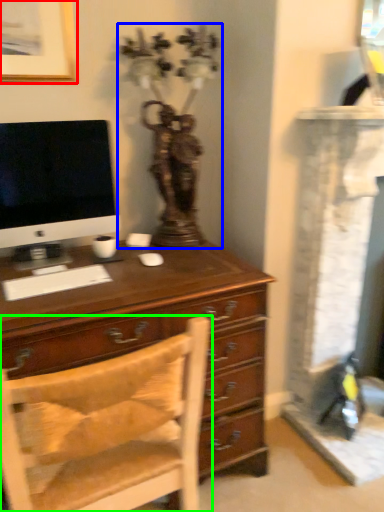
Question: Estimate the real-world distances between objects in this image. Which object is farther from picture frame (highlighted by a red box), antique (highlighted by a blue box) or chair (highlighted by a green box)?

Choices:
 (A) antique
 (B) chair

Answer: (B)